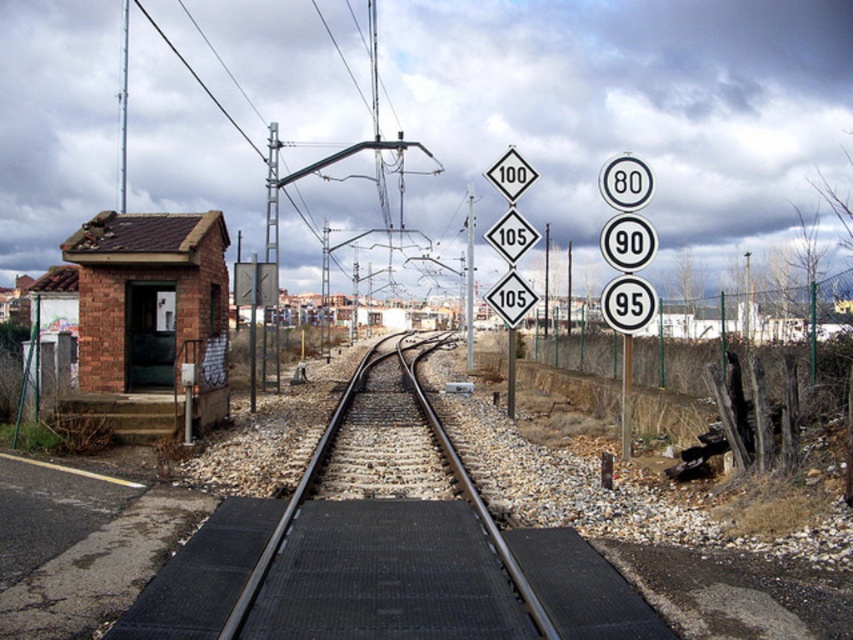
Question: Estimate the real-world distances between objects in this image. Which object is closer to the diamond-shaped white at center?

Choices:
 (A) diamond-shapedwhitetraffic sign at center
 (B) black metal train track at center
 (C) white plastic speed limit sign at center right
 (D) metallic pole at right

Answer: (A)

Question: Does white reflective speed limit sign at upper right lie in front of white plastic speed limit sign at center right?

Choices:
 (A) no
 (B) yes

Answer: (A)

Question: Among these objects, which one is nearest to the camera?

Choices:
 (A) white diamond-shaped speed limit sign at upper center
 (B) diamond-shapedwhitetraffic sign at center

Answer: (A)

Question: Among these points, which one is nearest to the camera?

Choices:
 (A) (521, 168)
 (B) (633, 330)
 (C) (469, 289)

Answer: (B)

Question: Is black metal train track at center to the left of white plastic speed limit sign at center right from the viewer's perspective?

Choices:
 (A) no
 (B) yes

Answer: (B)

Question: Does black metal train track at center appear on the right side of white diamond-shaped speed limit sign at upper center?

Choices:
 (A) yes
 (B) no

Answer: (B)